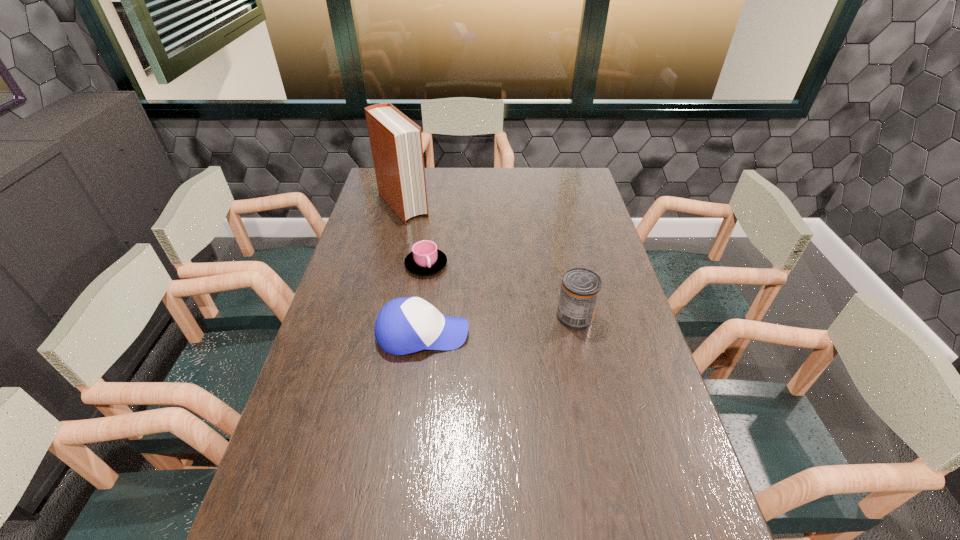
Where is `free space at the near edge of the desktop`? free space at the near edge of the desktop is located at coordinates point(409,522).

Locate an element on the screen. This screenshot has height=540, width=960. vacant space at the left edge of the desktop is located at coordinates (327, 351).

The height and width of the screenshot is (540, 960). Find the location of `free point at the right edge`. free point at the right edge is located at coordinates (574, 215).

Locate an element on the screen. This screenshot has width=960, height=540. vacant space at the far right corner of the desktop is located at coordinates (578, 187).

The width and height of the screenshot is (960, 540). What are the coordinates of `vacant space at the near right corner` in the screenshot? It's located at 675,532.

At what (x,y) coordinates should I click in order to perform the action: click on vacant space that is in between the rightmost object and the cup. Please return your answer as a coordinate pair (x, y). Looking at the image, I should click on (500, 291).

This screenshot has height=540, width=960. Identify the location of free space that is in between the baseball cap and the rightmost object. (499, 325).

Locate an element on the screen. free space between the rightmost object and the second shortest object is located at coordinates (499, 325).

This screenshot has width=960, height=540. Find the location of `free space between the second tallest object and the hardback book`. free space between the second tallest object and the hardback book is located at coordinates (489, 261).

This screenshot has width=960, height=540. I want to click on empty location between the tallest object and the cup, so click(415, 235).